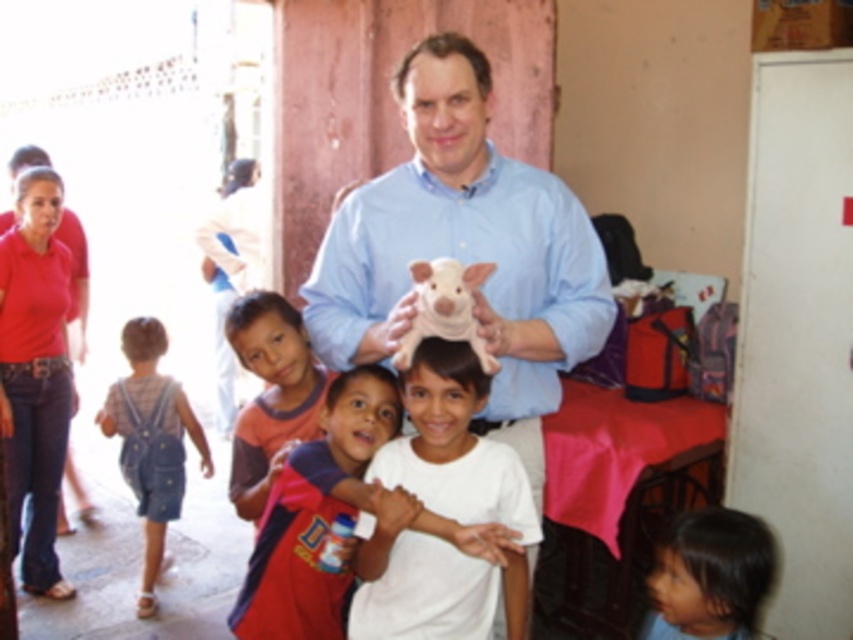
Question: Is blue smooth shirt at center below orange cotton shirt at lower left?

Choices:
 (A) no
 (B) yes

Answer: (A)

Question: Does blue smooth shirt at center appear over white matte shirt at center?

Choices:
 (A) no
 (B) yes

Answer: (B)

Question: Is blue smooth shirt at center to the right of denim overalls at left from the viewer's perspective?

Choices:
 (A) no
 (B) yes

Answer: (B)

Question: Which of the following is the farthest from the observer?

Choices:
 (A) (241, 468)
 (B) (263, 582)

Answer: (A)

Question: Which is nearer to the denim overalls at left?

Choices:
 (A) orange cotton shirt at lower left
 (B) white matte shirt at center
 (C) blue smooth shirt at center
 (D) white plush pig at center

Answer: (A)

Question: Among these points, which one is nearest to the camera?

Choices:
 (A) (672, 532)
 (B) (517, 472)
 (C) (125, 378)

Answer: (B)